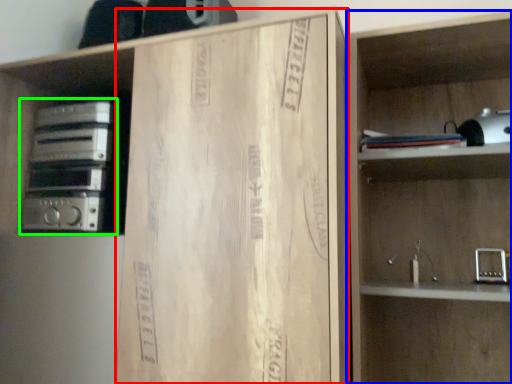
Question: Which object is the farthest from cardboard (highlighted by a red box)? Choose among these: shelf (highlighted by a blue box) or stereo (highlighted by a green box).

Choices:
 (A) shelf
 (B) stereo

Answer: (B)